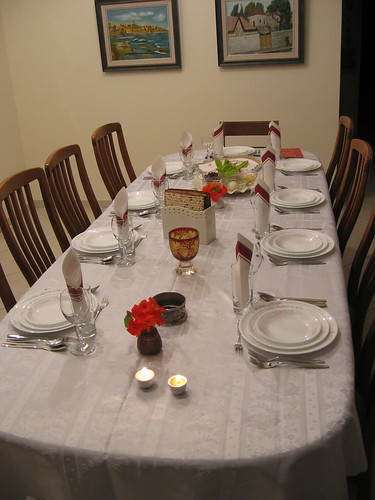
Locate an element on the screen. Image resolution: width=375 pixels, height=500 pixels. place settings on a table is located at coordinates (287, 334), (298, 246), (296, 201), (297, 161), (238, 152), (172, 164), (137, 201), (96, 244), (42, 330).